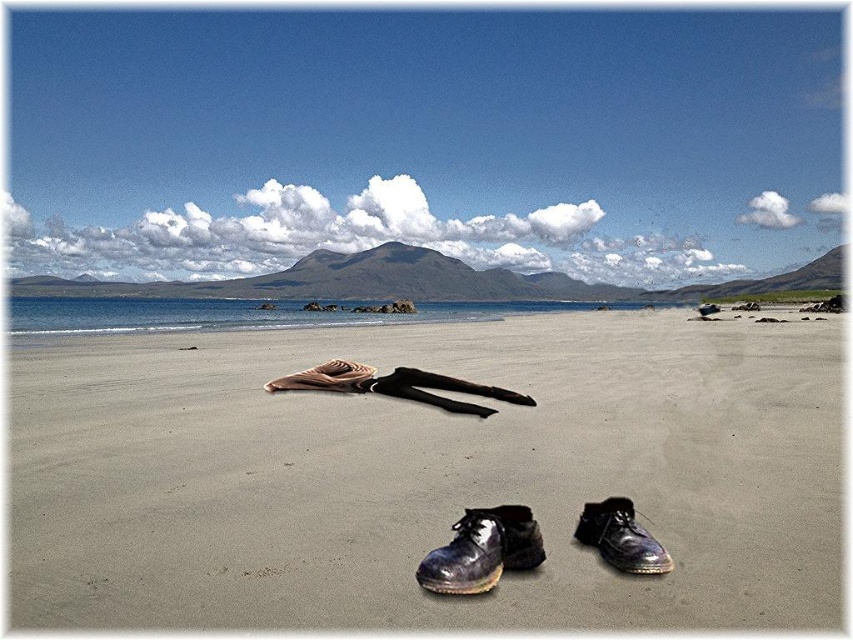
Does shiny black boot at lower center lie in front of shiny black shoe at lower right?

That is True.

Who is higher up, shiny black boot at lower center or shiny black shoe at lower right?

shiny black boot at lower center

The height and width of the screenshot is (640, 853). Identify the location of shiny black boot at lower center. (482, 550).

The image size is (853, 640). What do you see at coordinates (427, 474) in the screenshot?
I see `smooth sand at center` at bounding box center [427, 474].

Does smooth sand at center come behind shiny leather shoe at center?

No, it is in front of shiny leather shoe at center.

Is point (785, 438) closer to camera compared to point (519, 550)?

No, (785, 438) is behind (519, 550).

Locate an element on the screen. The image size is (853, 640). smooth sand at center is located at coordinates (427, 474).

Who is shorter, smooth sand at center or shiny black boot at lower center?

shiny black boot at lower center is shorter.

From the picture: Does smooth sand at center have a larger size compared to shiny black boot at lower center?

Correct, smooth sand at center is larger in size than shiny black boot at lower center.

What are the coordinates of `smooth sand at center` in the screenshot? It's located at (427, 474).

The height and width of the screenshot is (640, 853). Find the location of `smooth sand at center`. smooth sand at center is located at coordinates (427, 474).